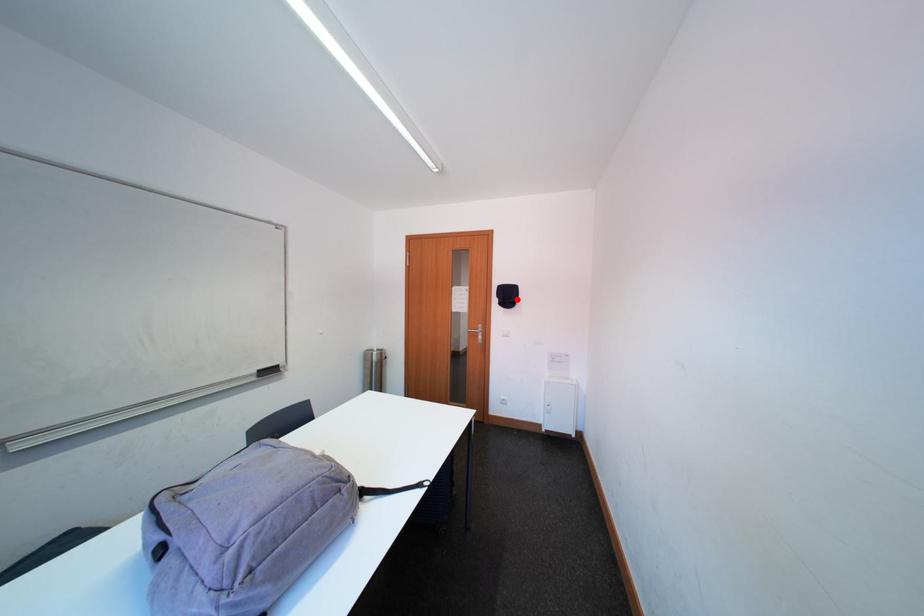
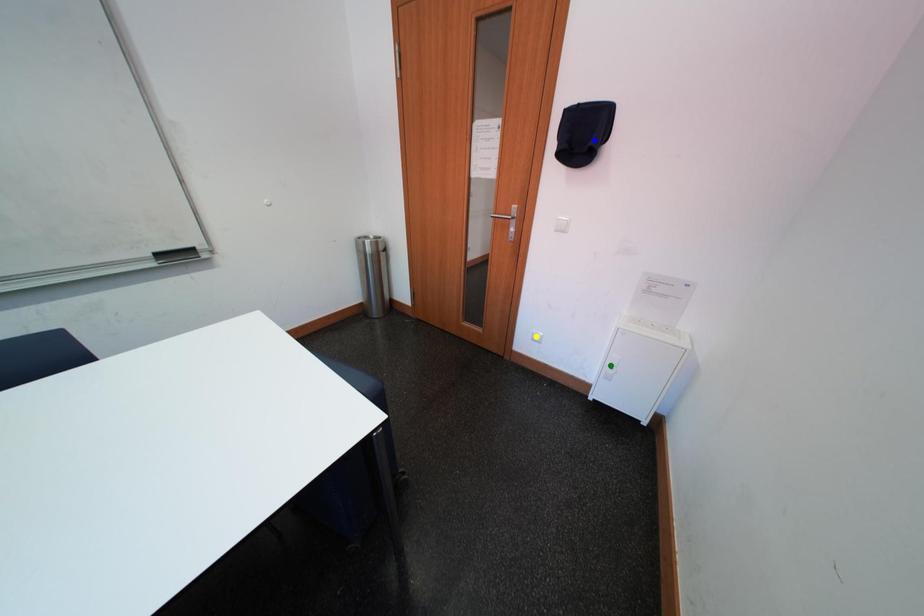
Question: I am providing you with two images of the same scene from different viewpoints. A red point is marked on the first image. You are given multiple points on the second image. Which mark in image 2 goes with the point in image 1?

Choices:
 (A) green point
 (B) yellow point
 (C) blue point

Answer: (C)